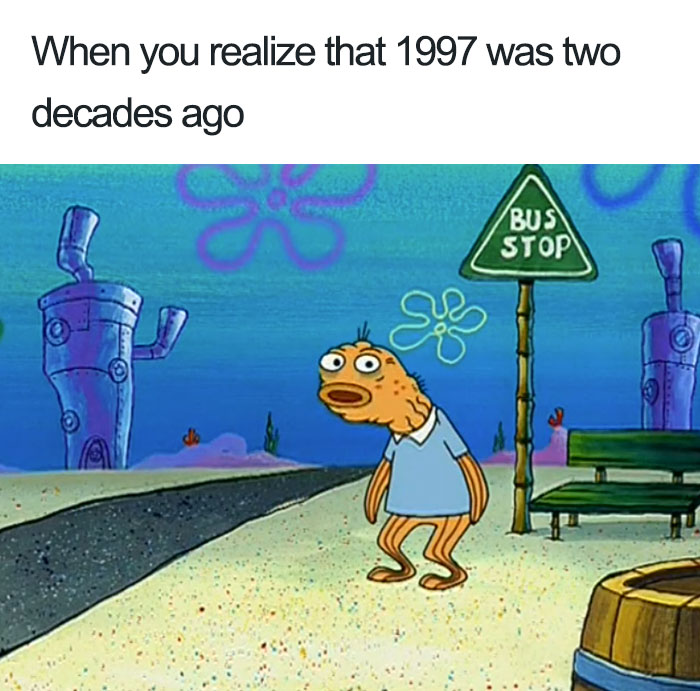
Find the location of a particular element. back bench leg is located at coordinates coord(687,520), coord(572,520).